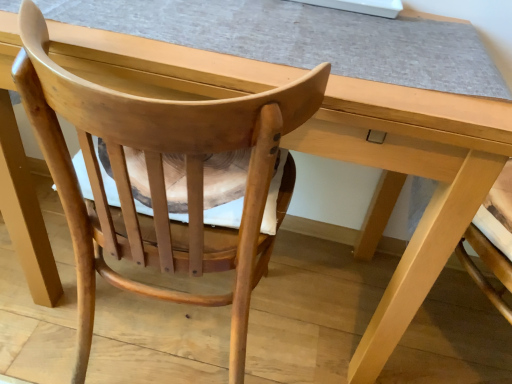
The width and height of the screenshot is (512, 384). What do you see at coordinates (158, 178) in the screenshot?
I see `natural wood chair at center` at bounding box center [158, 178].

Locate an element on the screen. The width and height of the screenshot is (512, 384). natural wood chair at center is located at coordinates (158, 178).

Identify the location of natural wood chair at center. (158, 178).